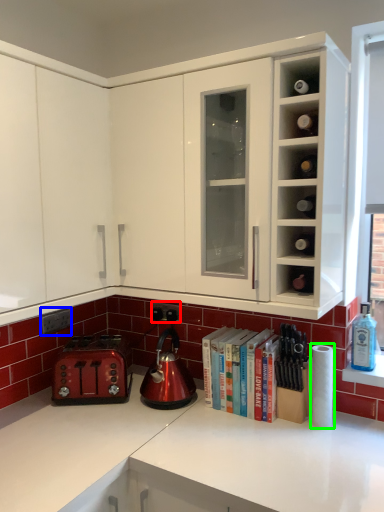
Question: Which object is positioned closest to electric outlet (highlighted by a red box)? Select from electric outlet (highlighted by a blue box) and paper towel (highlighted by a green box).

Choices:
 (A) electric outlet
 (B) paper towel

Answer: (A)